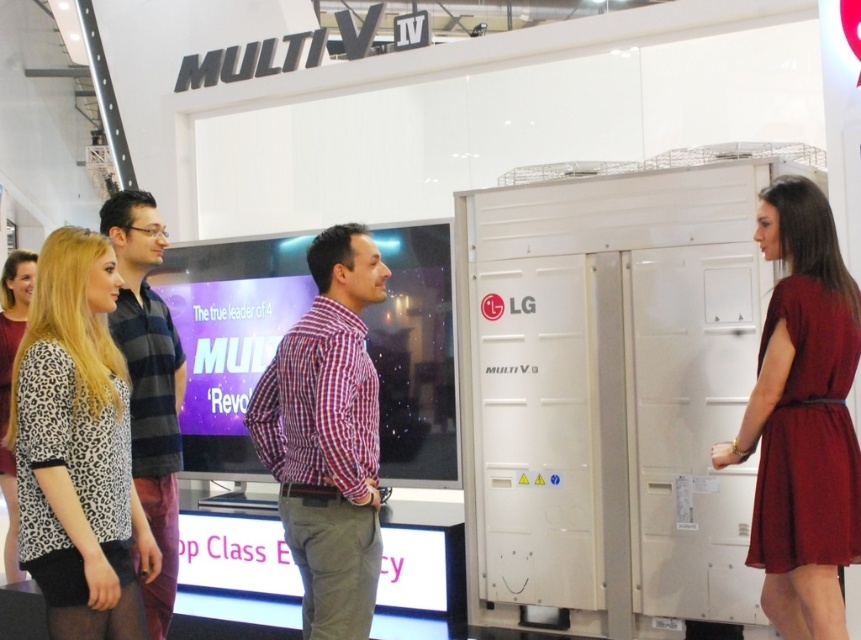
Is leopard print blouse at center to the right of red checkered shirt at center from the viewer's perspective?

No, leopard print blouse at center is not to the right of red checkered shirt at center.

Is point (102, 429) positioned after point (366, 544)?

No, it is not.

Is point (110, 400) farther from viewer compared to point (251, 435)?

No, it is in front of (251, 435).

At what (x,y) coordinates should I click in order to perform the action: click on leopard print blouse at center. Please return your answer as a coordinate pair (x, y). The width and height of the screenshot is (861, 640). Looking at the image, I should click on (77, 449).

Between point (819, 570) and point (351, 394), which one is positioned behind?

The point (351, 394) is behind.

Is burgundy satin dress at right to the left of red checkered shirt at center from the viewer's perspective?

No, burgundy satin dress at right is not to the left of red checkered shirt at center.

You are a GUI agent. You are given a task and a screenshot of the screen. Output one action in this format:
    pyautogui.click(x=<x>, y=<y>)
    Task: Click on the burgundy satin dress at right
    Image resolution: width=861 pixels, height=640 pixels.
    Given the screenshot: What is the action you would take?
    [802, 419]

Can you confirm if burgundy satin dress at right is positioned below leopard print dress at lower left?

No.

Does burgundy satin dress at right have a smaller size compared to leopard print dress at lower left?

Yes, burgundy satin dress at right is smaller than leopard print dress at lower left.

Which is in front, point (858, 300) or point (23, 577)?

Point (858, 300) is in front.

Where is `burgundy satin dress at right`? The image size is (861, 640). burgundy satin dress at right is located at coordinates (802, 419).